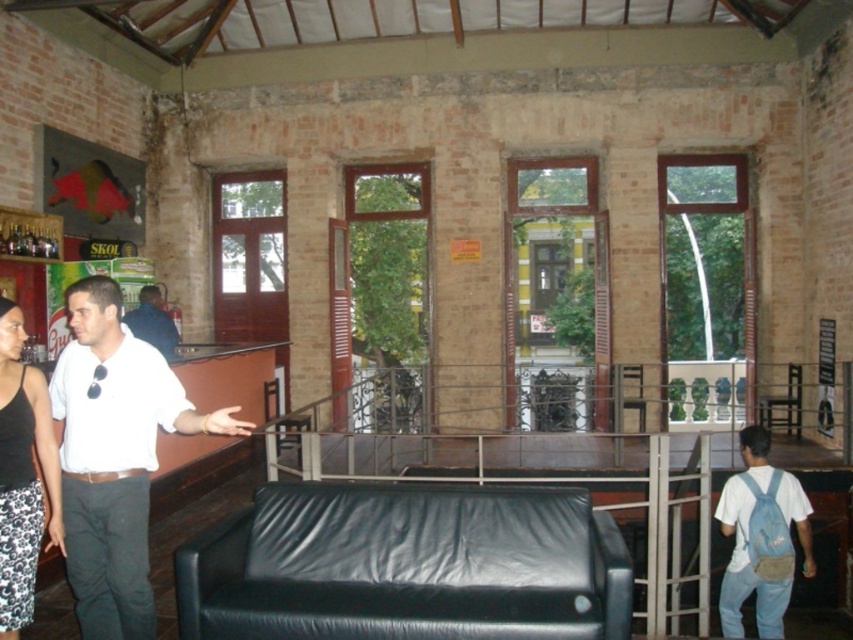
Can you confirm if black textured tank top at left is positioned to the right of denim backpack at lower right?

In fact, black textured tank top at left is to the left of denim backpack at lower right.

Is black textured tank top at left thinner than denim backpack at lower right?

Correct, black textured tank top at left's width is less than denim backpack at lower right's.

Is point (15, 524) farther from camera compared to point (759, 476)?

No, it is in front of (759, 476).

You are a GUI agent. You are given a task and a screenshot of the screen. Output one action in this format:
    pyautogui.click(x=<x>, y=<y>)
    Task: Click on the black textured tank top at left
    
    Given the screenshot: What is the action you would take?
    pos(22,474)

Which is below, denim backpack at lower right or dark blue shirt at left?

denim backpack at lower right is lower down.

Does denim backpack at lower right appear on the left side of dark blue shirt at left?

No, denim backpack at lower right is not to the left of dark blue shirt at left.

At what (x,y) coordinates should I click in order to perform the action: click on denim backpack at lower right. Please return your answer as a coordinate pair (x, y). This screenshot has height=640, width=853. Looking at the image, I should click on (746, 570).

Between white shirt at left and dark blue shirt at left, which one is positioned higher?

dark blue shirt at left

The image size is (853, 640). Describe the element at coordinates (114, 456) in the screenshot. I see `white shirt at left` at that location.

Between point (126, 340) and point (155, 323), which one is positioned behind?

Positioned behind is point (155, 323).

The width and height of the screenshot is (853, 640). In order to click on white shirt at left in this screenshot , I will do `click(114, 456)`.